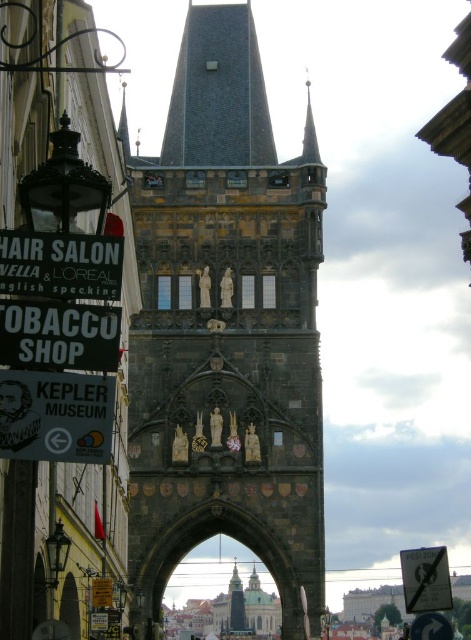
Can you confirm if black plastic signboard at lower left is bigger than white plastic sign at lower right?

No, black plastic signboard at lower left is not bigger than white plastic sign at lower right.

Image resolution: width=471 pixels, height=640 pixels. I want to click on black plastic signboard at lower left, so click(x=58, y=336).

Identify the location of black plastic signboard at lower left. The image size is (471, 640). (58, 336).

Can you confirm if dark gray stone tower at center is positioned to the right of black plastic hair salon sign at upper left?

Yes, dark gray stone tower at center is to the right of black plastic hair salon sign at upper left.

Is point (264, 109) positioned behind point (73, 259)?

Yes.

Where is `dark gray stone tower at center`? dark gray stone tower at center is located at coordinates (226, 332).

Between point (86, 337) and point (16, 266), which one is positioned behind?

Point (16, 266)

Does point (37, 332) lie behind point (70, 236)?

No, it is not.

What do you see at coordinates (58, 336) in the screenshot?
I see `black plastic signboard at lower left` at bounding box center [58, 336].

Image resolution: width=471 pixels, height=640 pixels. In order to click on black plastic signboard at lower left in this screenshot , I will do pos(58,336).